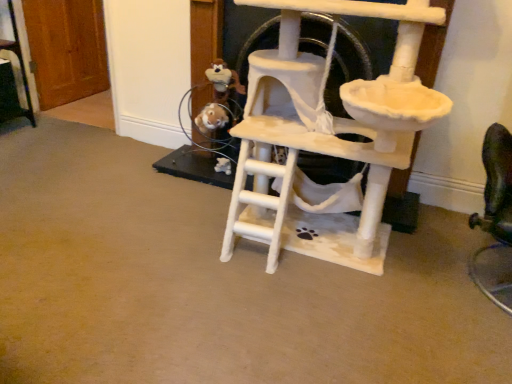
At what (x,y) coordinates should I click in order to perform the action: click on vacant space positioned to the left of white fabric cat tree at center. Please return your answer as a coordinate pair (x, y). The image size is (512, 384). Looking at the image, I should click on (153, 243).